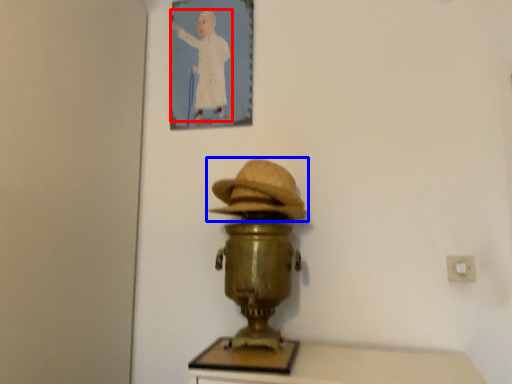
Question: Which point is closer to the camera, person (highlighted by a red box) or hat (highlighted by a blue box)?

Choices:
 (A) person
 (B) hat

Answer: (B)